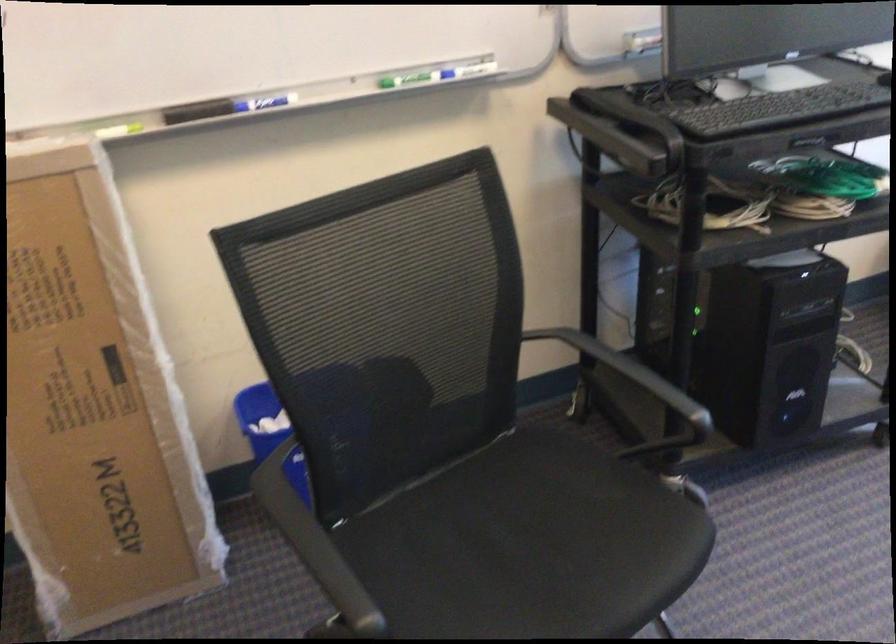
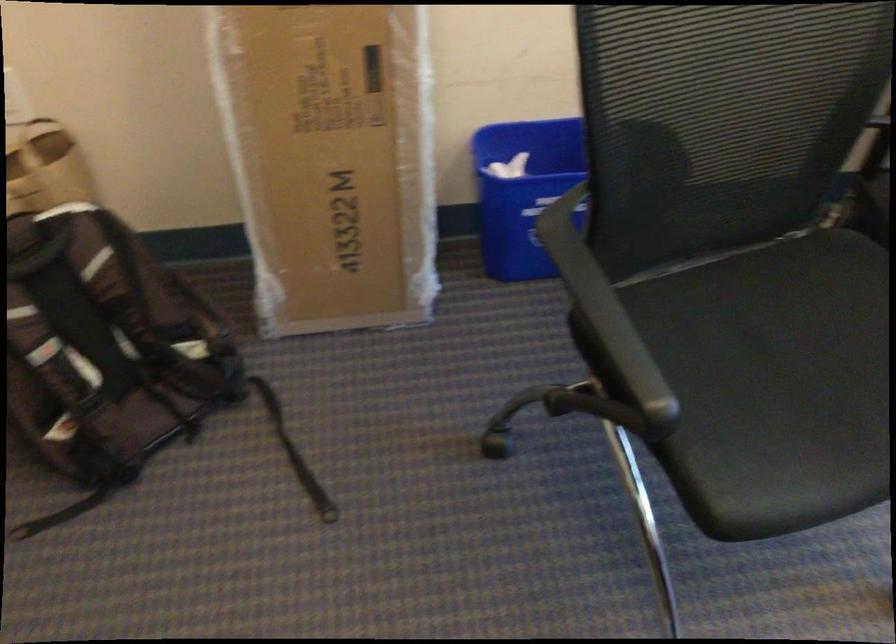
Which direction would the cameraman need to move to produce the second image?

The cameraman moved toward left, forward.